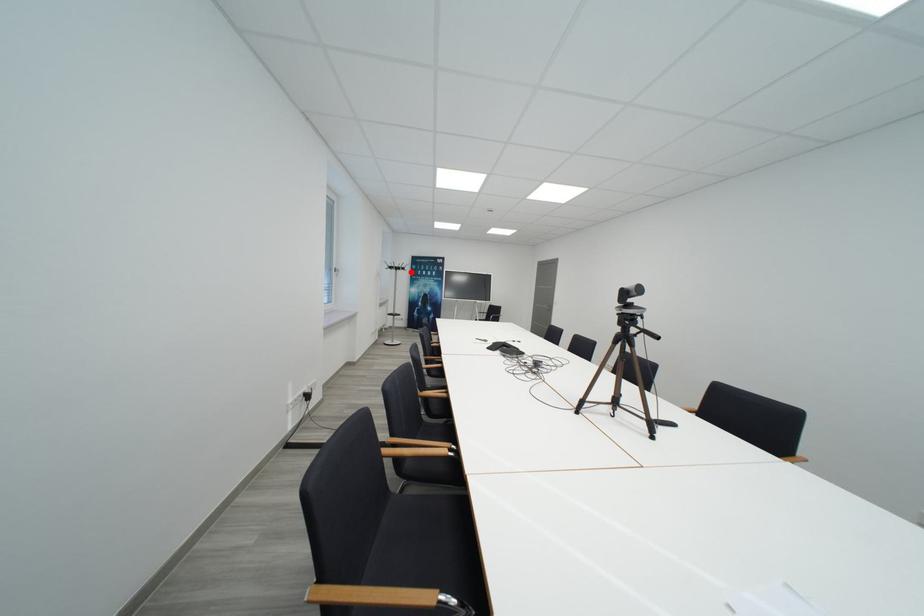
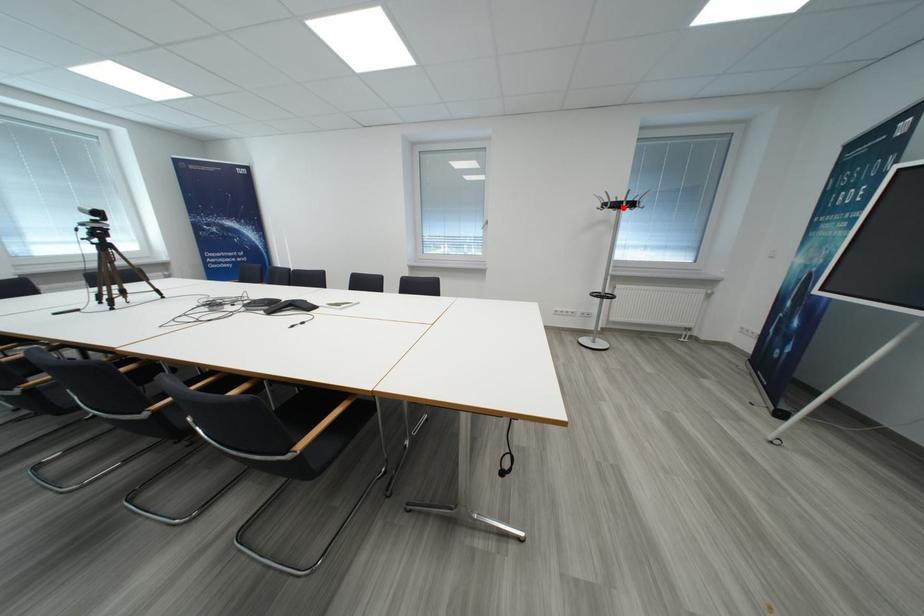
I am providing you with two images of the same scene from different viewpoints. A red point is marked on the first image and another point is marked on the second image. Is the marked point in image1 the same physical position as the marked point in image2?

Yes